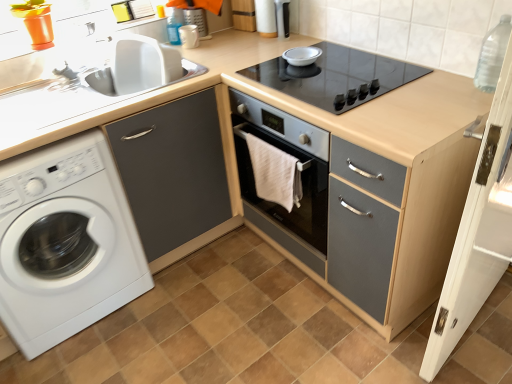
Locate an element on the screen. The height and width of the screenshot is (384, 512). vacant area that lies to the right of matte white mug at upper center, marked as the 1th appliance in a left-to-right arrangement is located at coordinates tap(228, 46).